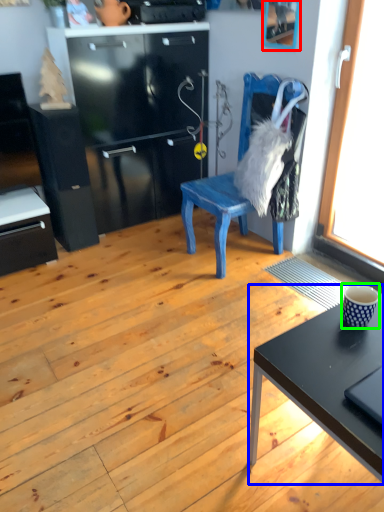
Question: Which object is positioned closest to picture frame (highlighted by a red box)? Select from desk (highlighted by a blue box) and coffee cup (highlighted by a green box).

Choices:
 (A) desk
 (B) coffee cup

Answer: (B)